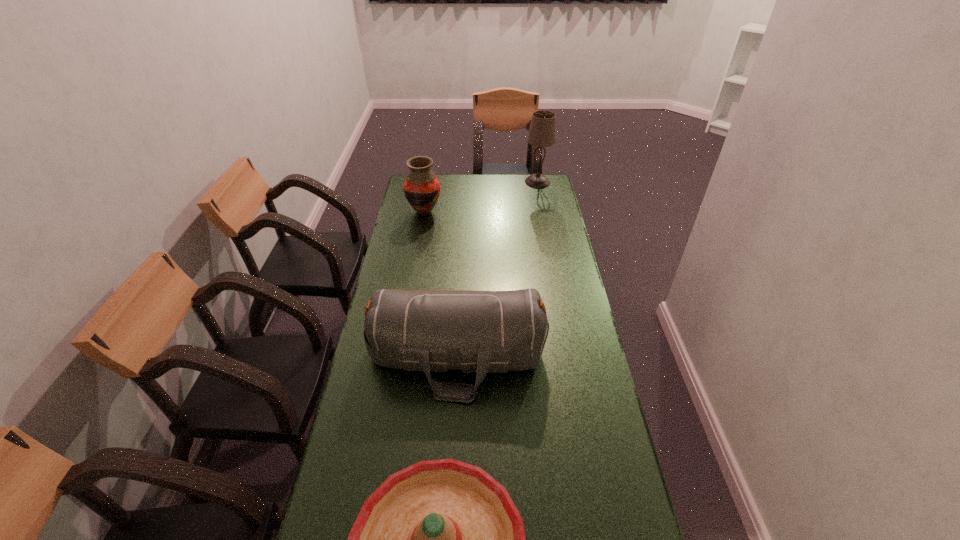
At what (x,y) coordinates should I click in order to perform the action: click on vacant region between the rightmost object and the duffel bag. Please return your answer as a coordinate pair (x, y). Looking at the image, I should click on [x=497, y=269].

This screenshot has width=960, height=540. I want to click on free space between the second nearest object and the farthest object, so click(497, 269).

Identify the location of free area in between the second nearest object and the second farthest object. The image size is (960, 540). (441, 285).

Identify which object is the second closest to the sombrero. Please provide its 2D coordinates. Your answer should be formatted as a tuple, i.e. [(x, y)], where the tuple contains the x and y coordinates of a point satisfying the conditions above.

[(421, 187)]

This screenshot has width=960, height=540. In order to click on object that is the third closest one to the vase in this screenshot , I will do `click(441, 539)`.